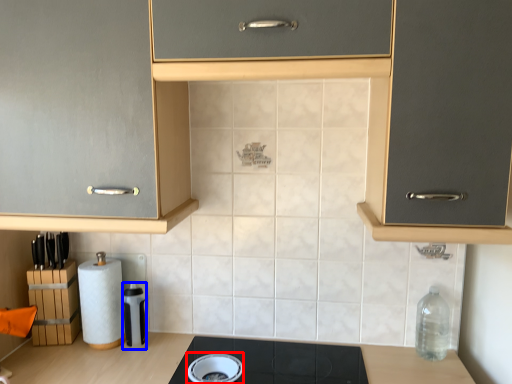
Question: Which of the following is the farthest to the observer, appliance (highlighted by a red box) or appliance (highlighted by a blue box)?

Choices:
 (A) appliance
 (B) appliance

Answer: (B)